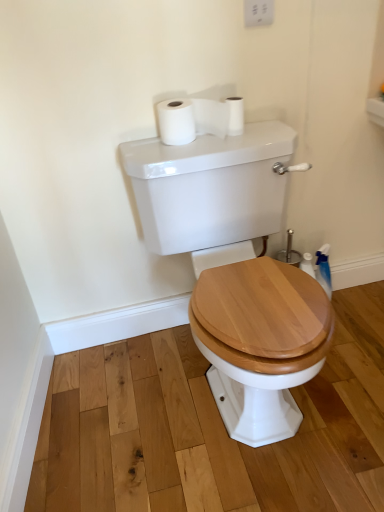
The image size is (384, 512). Identify the location of unoccupied region to the right of white matte toilet paper at upper center, which ranks as the second toilet paper in left-to-right order. (265, 130).